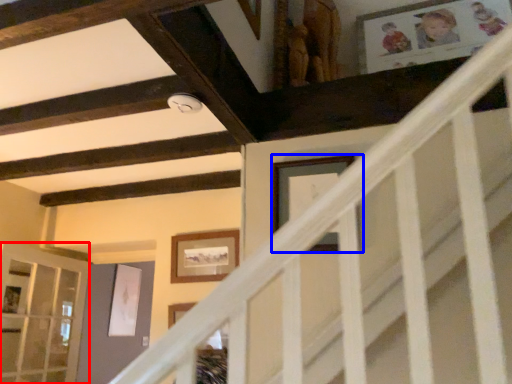
Question: Which point is further to the camera, glass door (highlighted by a red box) or picture frame (highlighted by a blue box)?

Choices:
 (A) glass door
 (B) picture frame

Answer: (A)